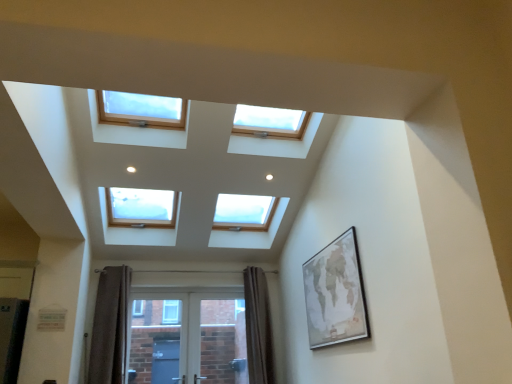
Question: From a real-world perspective, does wooden-framed map at right stand above brown textured curtain at lower center, which ranks as the first curtain in right-to-left order?

Choices:
 (A) yes
 (B) no

Answer: (A)

Question: Is wooden-framed map at right smaller than brown textured curtain at lower center, which ranks as the first curtain in right-to-left order?

Choices:
 (A) no
 (B) yes

Answer: (B)

Question: Is wooden-framed map at right shorter than brown textured curtain at lower center, marked as the 2th curtain in a left-to-right arrangement?

Choices:
 (A) yes
 (B) no

Answer: (A)

Question: From the image's perspective, is wooden-framed map at right on top of brown textured curtain at lower center, marked as the 2th curtain in a left-to-right arrangement?

Choices:
 (A) no
 (B) yes

Answer: (B)

Question: Is wooden-framed map at right not within brown textured curtain at lower center, which ranks as the first curtain in right-to-left order?

Choices:
 (A) yes
 (B) no

Answer: (A)

Question: In terms of size, does white glossy screen door at lower center appear bigger or smaller than brown velvet curtain at lower left, acting as the 1th curtain starting from the left?

Choices:
 (A) big
 (B) small

Answer: (A)

Question: Visually, is white glossy screen door at lower center positioned to the left or to the right of brown velvet curtain at lower left, marked as the 2th curtain in a right-to-left arrangement?

Choices:
 (A) left
 (B) right

Answer: (B)

Question: Is white glossy screen door at lower center in front of or behind brown velvet curtain at lower left, acting as the 1th curtain starting from the left, in the image?

Choices:
 (A) behind
 (B) front

Answer: (A)

Question: Choose the correct answer: Is white glossy screen door at lower center inside brown velvet curtain at lower left, marked as the 2th curtain in a right-to-left arrangement, or outside it?

Choices:
 (A) outside
 (B) inside

Answer: (A)

Question: In terms of height, does brown textured curtain at lower center, marked as the 2th curtain in a left-to-right arrangement, look taller or shorter compared to wooden-framed map at right?

Choices:
 (A) short
 (B) tall

Answer: (B)

Question: From a real-world perspective, is brown textured curtain at lower center, which ranks as the first curtain in right-to-left order, physically located above or below wooden-framed map at right?

Choices:
 (A) above
 (B) below

Answer: (B)

Question: In terms of size, does brown textured curtain at lower center, marked as the 2th curtain in a left-to-right arrangement, appear bigger or smaller than wooden-framed map at right?

Choices:
 (A) small
 (B) big

Answer: (B)

Question: Is point (x=262, y=337) positioned closer to the camera than point (x=317, y=342)?

Choices:
 (A) closer
 (B) farther

Answer: (B)

Question: Considering the positions of wooden-framed map at right and brown textured curtain at lower center, marked as the 2th curtain in a left-to-right arrangement, in the image, is wooden-framed map at right bigger or smaller than brown textured curtain at lower center, marked as the 2th curtain in a left-to-right arrangement,?

Choices:
 (A) small
 (B) big

Answer: (A)

Question: In the image, is wooden-framed map at right positioned in front of or behind brown textured curtain at lower center, which ranks as the first curtain in right-to-left order?

Choices:
 (A) behind
 (B) front

Answer: (B)